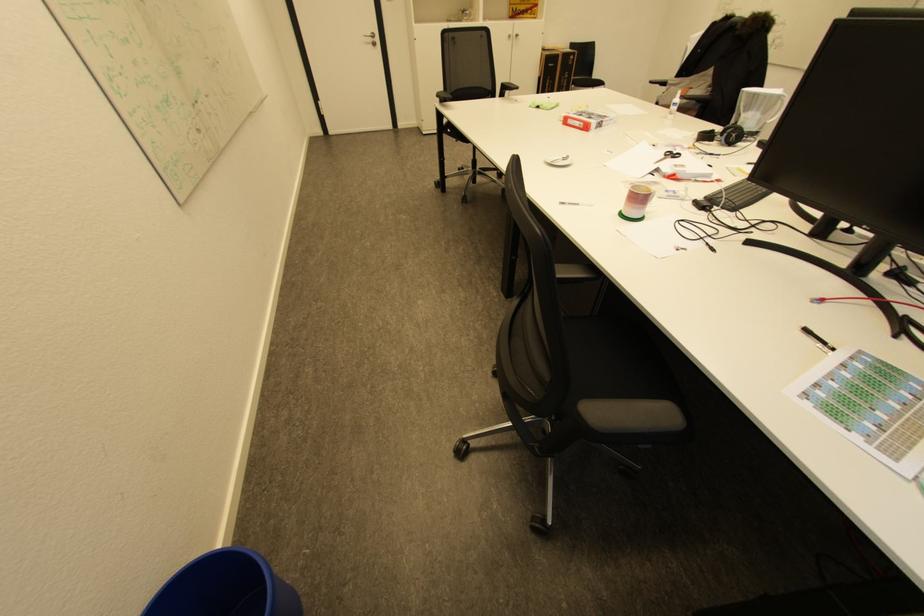
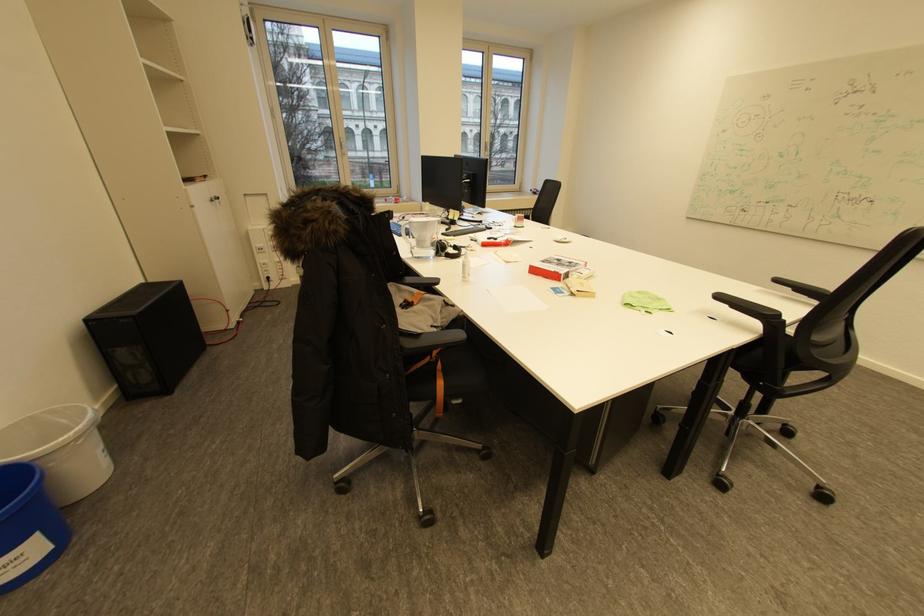
Find the pixel in the second image that matches point 587,116 in the first image.

(576, 262)